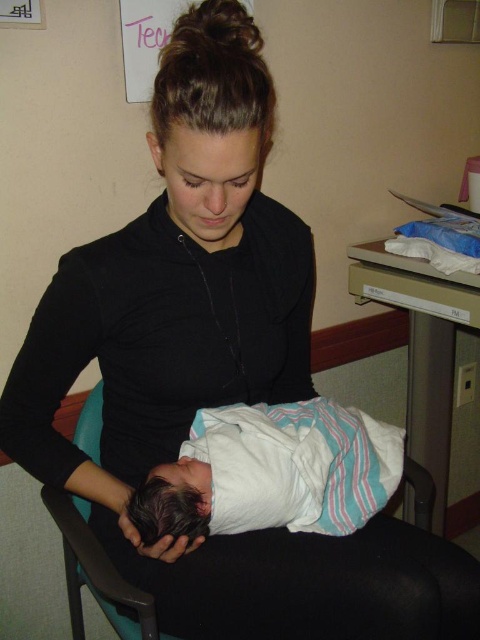
Question: Can you confirm if white striped swaddle at center is wider than black fabric chair at lower center?

Choices:
 (A) yes
 (B) no

Answer: (B)

Question: In this image, where is white striped swaddle at center located relative to black fabric chair at lower center?

Choices:
 (A) above
 (B) below

Answer: (A)

Question: Which point is farther to the camera?

Choices:
 (A) black fabric chair at lower center
 (B) white striped swaddle at center

Answer: (A)

Question: Which object is farther from the camera taking this photo?

Choices:
 (A) white striped swaddle at center
 (B) black fabric chair at lower center

Answer: (B)

Question: Is white striped swaddle at center further to camera compared to black fabric chair at lower center?

Choices:
 (A) no
 (B) yes

Answer: (A)